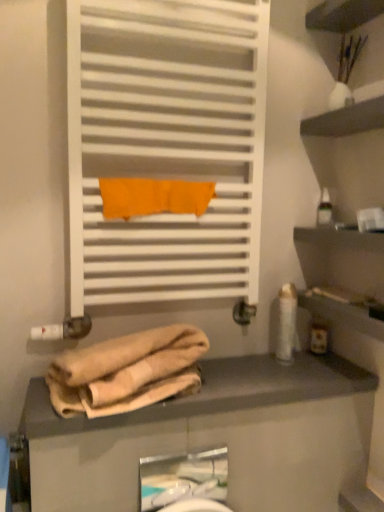
Question: Could you tell me if translucent plastic bottle at right, positioned as the third toiletry in top-to-bottom order, is facing white glossy lotion at right, the 2th toiletry positioned from the bottom?

Choices:
 (A) no
 (B) yes

Answer: (A)

Question: Is translucent plastic bottle at right, which is counted as the second toiletry, starting from the left, beside white glossy lotion at right, which is the second toiletry in top-to-bottom order?

Choices:
 (A) no
 (B) yes

Answer: (A)

Question: Is translucent plastic bottle at right, which ranks as the second toiletry in right-to-left order, positioned far away from white glossy lotion at right, the 2th toiletry positioned from the bottom?

Choices:
 (A) yes
 (B) no

Answer: (B)

Question: Is translucent plastic bottle at right, which ranks as the second toiletry in right-to-left order, looking in the opposite direction of white glossy lotion at right, marked as the third toiletry in a right-to-left arrangement?

Choices:
 (A) yes
 (B) no

Answer: (B)

Question: Does translucent plastic bottle at right, which is counted as the second toiletry, starting from the left, come behind white glossy lotion at right, the 1th toiletry in the left-to-right sequence?

Choices:
 (A) yes
 (B) no

Answer: (A)

Question: From a real-world perspective, is translucent plastic bottle at right, positioned as the 1th toiletry in bottom-to-top order, physically below white glossy lotion at right, marked as the third toiletry in a right-to-left arrangement?

Choices:
 (A) yes
 (B) no

Answer: (A)

Question: From the image's perspective, is white glossy sink at lower center above transparent plastic bottle at upper right, the third toiletry viewed from the left?

Choices:
 (A) yes
 (B) no

Answer: (B)

Question: Is white glossy sink at lower center shorter than transparent plastic bottle at upper right, the 3th toiletry in the bottom-to-top sequence?

Choices:
 (A) no
 (B) yes

Answer: (A)

Question: Would you say transparent plastic bottle at upper right, the first toiletry positioned from the right, is part of white glossy sink at lower center's contents?

Choices:
 (A) no
 (B) yes

Answer: (A)

Question: Is white glossy sink at lower center at the right side of transparent plastic bottle at upper right, which is counted as the 1th toiletry, starting from the top?

Choices:
 (A) no
 (B) yes

Answer: (A)

Question: Is the depth of white glossy sink at lower center less than that of transparent plastic bottle at upper right, the first toiletry positioned from the right?

Choices:
 (A) yes
 (B) no

Answer: (A)

Question: Does white glossy sink at lower center have a lesser width compared to transparent plastic bottle at upper right, the 3th toiletry in the bottom-to-top sequence?

Choices:
 (A) yes
 (B) no

Answer: (A)

Question: Can you confirm if white glossy lotion at right, which is the second toiletry in top-to-bottom order, is positioned to the left of beige fabric at lower center?

Choices:
 (A) no
 (B) yes

Answer: (A)